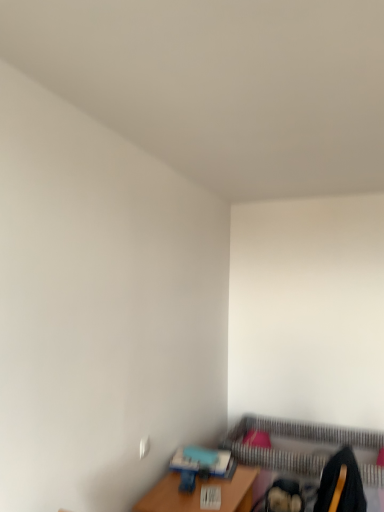
Question: From a real-world perspective, is wooden table at lower right above or below metallic gold swivel chair at lower right?

Choices:
 (A) below
 (B) above

Answer: (A)

Question: In terms of height, does wooden table at lower right look taller or shorter compared to metallic gold swivel chair at lower right?

Choices:
 (A) short
 (B) tall

Answer: (A)

Question: Which object is the farthest from the metallic gold swivel chair at lower right?

Choices:
 (A) striped fabric bed frame at lower right
 (B) wooden table at lower right

Answer: (A)

Question: Estimate the real-world distances between objects in this image. Which object is farther from the metallic gold swivel chair at lower right?

Choices:
 (A) striped fabric bed frame at lower right
 (B) wooden table at lower right

Answer: (A)